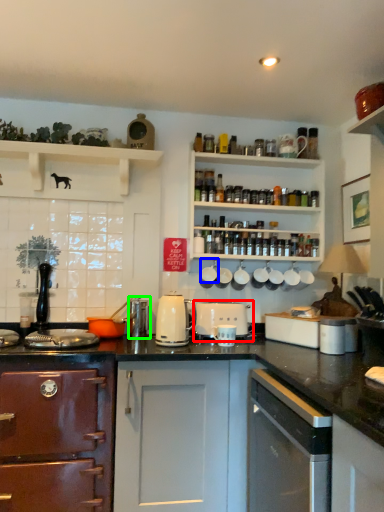
Question: Which object is positioned farthest from appliance (highlighted by a red box)? Select from appliance (highlighted by a blue box) and appliance (highlighted by a green box).

Choices:
 (A) appliance
 (B) appliance

Answer: (B)